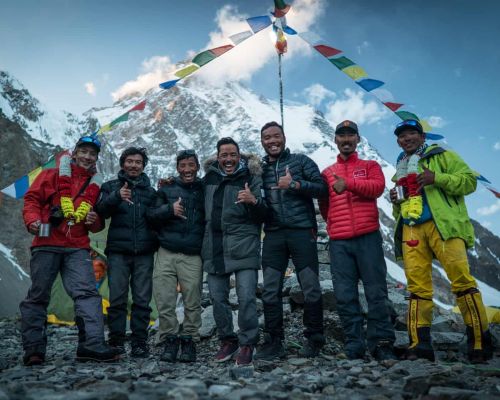
Where is `coat`? The width and height of the screenshot is (500, 400). coat is located at coordinates (49, 188), (126, 212), (180, 225), (229, 231), (288, 206), (360, 217), (443, 198).